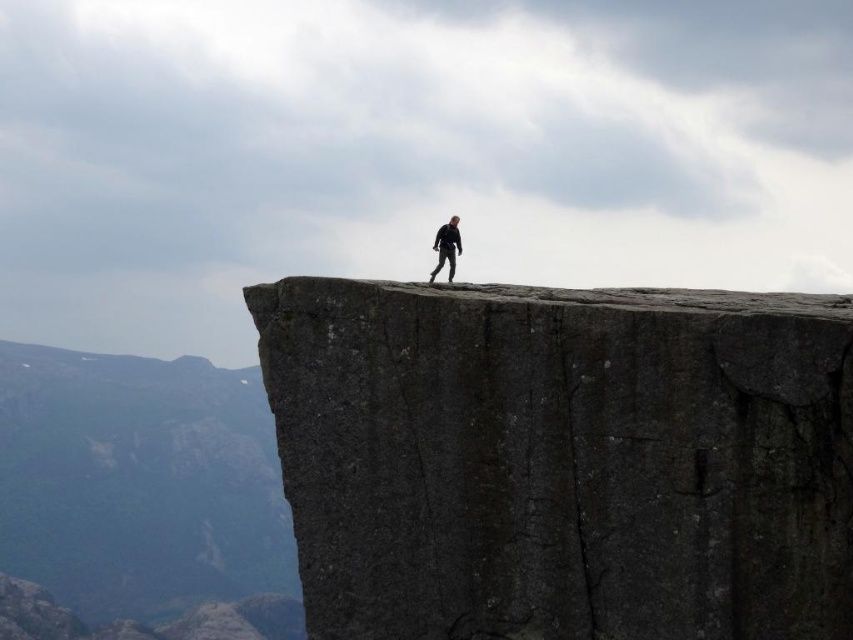
Does dark gray stone at center come in front of dark gray rock at center?

Yes, it is.

Does dark gray stone at center appear under dark gray rock at center?

Incorrect, dark gray stone at center is not positioned below dark gray rock at center.

Between point (355, 314) and point (273, 516), which one is positioned in front?

Point (355, 314) is in front.

Find the location of a particular element. dark gray stone at center is located at coordinates (561, 461).

Between dark gray rock at center and black matte suit at center, which one appears on the right side from the viewer's perspective?

black matte suit at center is more to the right.

Can you confirm if dark gray rock at center is taller than black matte suit at center?

Correct, dark gray rock at center is much taller as black matte suit at center.

Does point (79, 536) lie behind point (450, 241)?

Yes.

You are a GUI agent. You are given a task and a screenshot of the screen. Output one action in this format:
    pyautogui.click(x=<x>, y=<y>)
    Task: Click on the dark gray rock at center
    The width and height of the screenshot is (853, 640).
    Given the screenshot: What is the action you would take?
    pyautogui.click(x=138, y=483)

Can you confirm if dark gray stone at center is positioned above black matte suit at center?

No, dark gray stone at center is not above black matte suit at center.

Does point (335, 500) come farther from viewer compared to point (456, 230)?

No, it is in front of (456, 230).

This screenshot has height=640, width=853. I want to click on dark gray stone at center, so click(x=561, y=461).